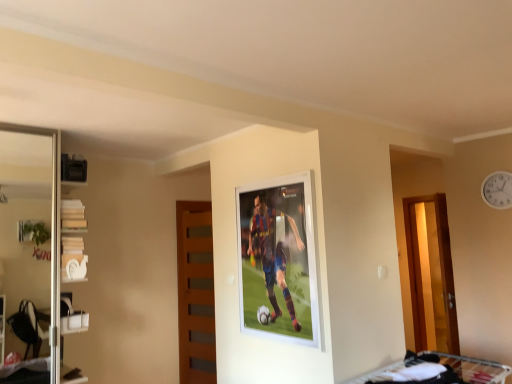
Question: Is wooden at center next to white glossy shelves at left?

Choices:
 (A) yes
 (B) no

Answer: (B)

Question: Is wooden at center not close to white glossy shelves at left?

Choices:
 (A) yes
 (B) no

Answer: (A)

Question: Is wooden at center looking in the opposite direction of white glossy shelves at left?

Choices:
 (A) no
 (B) yes

Answer: (A)

Question: From a real-world perspective, is wooden at center on top of white glossy shelves at left?

Choices:
 (A) no
 (B) yes

Answer: (A)

Question: Is wooden at center located outside white glossy shelves at left?

Choices:
 (A) yes
 (B) no

Answer: (A)

Question: From a real-world perspective, relative to wooden at center, is white fabric bunk bed at lower right vertically above or below?

Choices:
 (A) below
 (B) above

Answer: (A)

Question: From the image's perspective, is white fabric bunk bed at lower right located above or below wooden at center?

Choices:
 (A) below
 (B) above

Answer: (B)

Question: Is white fabric bunk bed at lower right wider or thinner than wooden at center?

Choices:
 (A) wide
 (B) thin

Answer: (A)

Question: Based on their sizes in the image, would you say white fabric bunk bed at lower right is bigger or smaller than wooden at center?

Choices:
 (A) small
 (B) big

Answer: (A)

Question: Is white plastic clock at upper right in front of or behind wooden at center in the image?

Choices:
 (A) front
 (B) behind

Answer: (A)

Question: Is white plastic clock at upper right spatially inside wooden at center, or outside of it?

Choices:
 (A) inside
 (B) outside

Answer: (B)

Question: Does point (497, 185) appear closer or farther from the camera than point (202, 344)?

Choices:
 (A) closer
 (B) farther

Answer: (A)

Question: From the image's perspective, relative to wooden at center, is white plastic clock at upper right above or below?

Choices:
 (A) below
 (B) above

Answer: (B)

Question: From a real-world perspective, is white glossy shelves at left above or below white fabric bunk bed at lower right?

Choices:
 (A) below
 (B) above

Answer: (B)

Question: Looking at their shapes, would you say white glossy shelves at left is wider or thinner than white fabric bunk bed at lower right?

Choices:
 (A) thin
 (B) wide

Answer: (A)